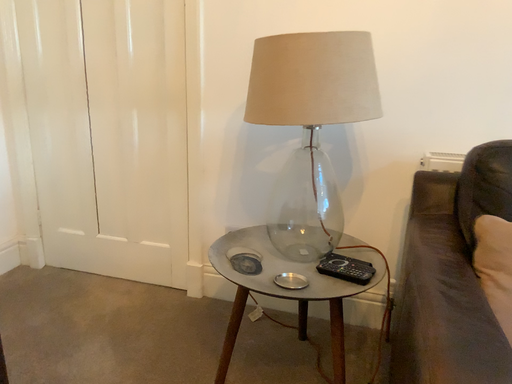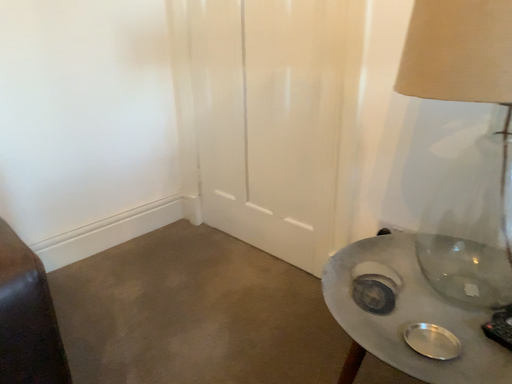
Question: Which way did the camera rotate in the video?

Choices:
 (A) rotated right
 (B) rotated left

Answer: (B)